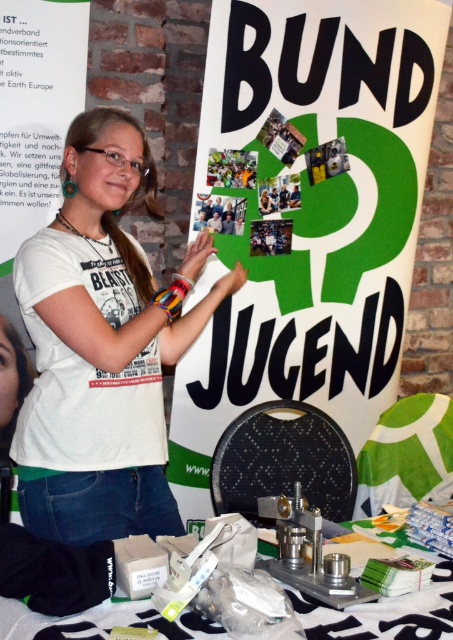
Who is taller, white paperboard at center or white matte t-shirt at center?

white paperboard at center is taller.

Between white paperboard at center and white matte t-shirt at center, which one is positioned lower?

white matte t-shirt at center is below.

Image resolution: width=453 pixels, height=640 pixels. What are the coordinates of `white paperboard at center` in the screenshot? It's located at (305, 212).

You are a GUI agent. You are given a task and a screenshot of the screen. Output one action in this format:
    pyautogui.click(x=<x>, y=<y>)
    Task: Click on the white paperboard at center
    The width and height of the screenshot is (453, 640).
    Given the screenshot: What is the action you would take?
    pyautogui.click(x=305, y=212)

Between white matte t-shirt at center and metallic silver tools at center, which one is positioned higher?

white matte t-shirt at center is above.

The height and width of the screenshot is (640, 453). I want to click on white matte t-shirt at center, so click(x=101, y=346).

Can you confirm if white paperboard at center is positioned below metallic silver tools at center?

Actually, white paperboard at center is above metallic silver tools at center.

Between white paperboard at center and metallic silver tools at center, which one has more height?

Standing taller between the two is white paperboard at center.

This screenshot has width=453, height=640. In order to click on white paperboard at center in this screenshot , I will do `click(305, 212)`.

At what (x,y) coordinates should I click in order to perform the action: click on white paperboard at center. Please return your answer as a coordinate pair (x, y). Looking at the image, I should click on (305, 212).